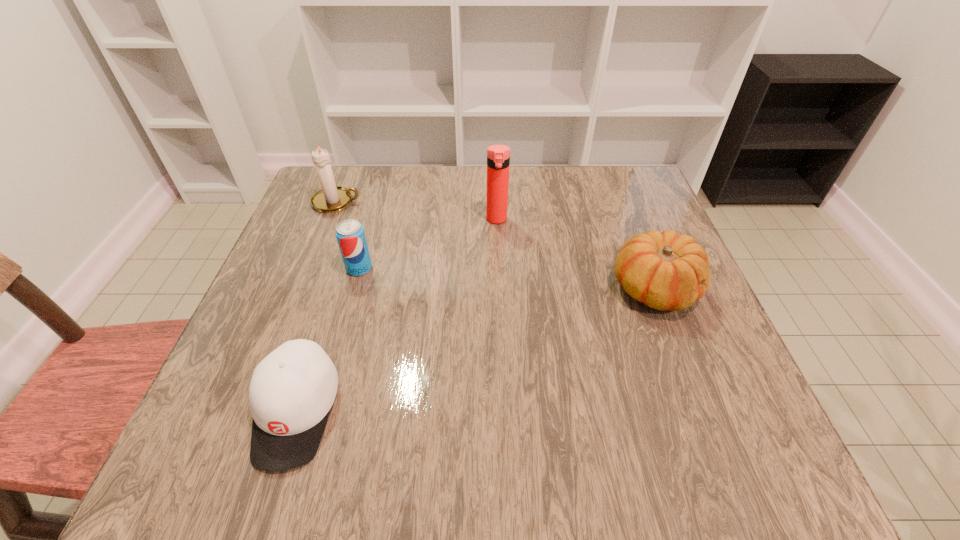
Find the location of a particular element. free space between the fourth shortest object and the nearest object is located at coordinates (317, 307).

Locate which object ranks in proximity to the fourth shortest object. Please provide its 2D coordinates. Your answer should be formatted as a tuple, i.e. [(x, y)], where the tuple contains the x and y coordinates of a point satisfying the conditions above.

[(350, 235)]

Identify which object is the fourth nearest to the fourth shortest object. Please provide its 2D coordinates. Your answer should be formatted as a tuple, i.e. [(x, y)], where the tuple contains the x and y coordinates of a point satisfying the conditions above.

[(666, 271)]

Locate an element on the screen. The height and width of the screenshot is (540, 960). vacant area in the image that satisfies the following two spatial constraints: 1. on the back side of the soda can; 2. on the handle side of the second tallest object is located at coordinates (377, 202).

Find the location of `free space that satisfies the following two spatial constraints: 1. on the handle side of the fourth shortest object; 2. on the right side of the rightmost object`. free space that satisfies the following two spatial constraints: 1. on the handle side of the fourth shortest object; 2. on the right side of the rightmost object is located at coordinates (302, 289).

You are a GUI agent. You are given a task and a screenshot of the screen. Output one action in this format:
    pyautogui.click(x=<x>, y=<y>)
    Task: Click on the free space that satisfies the following two spatial constraints: 1. on the handle side of the soda can; 2. on the left side of the fourth shortest object
    The height and width of the screenshot is (540, 960).
    Given the screenshot: What is the action you would take?
    pyautogui.click(x=310, y=268)

Where is `vacant space that satisfies the following two spatial constraints: 1. on the handle side of the candle holder; 2. on the right side of the rightmost object`? vacant space that satisfies the following two spatial constraints: 1. on the handle side of the candle holder; 2. on the right side of the rightmost object is located at coordinates (302, 289).

I want to click on blank area in the image that satisfies the following two spatial constraints: 1. on the handle side of the candle holder; 2. on the left side of the gourd, so click(x=302, y=289).